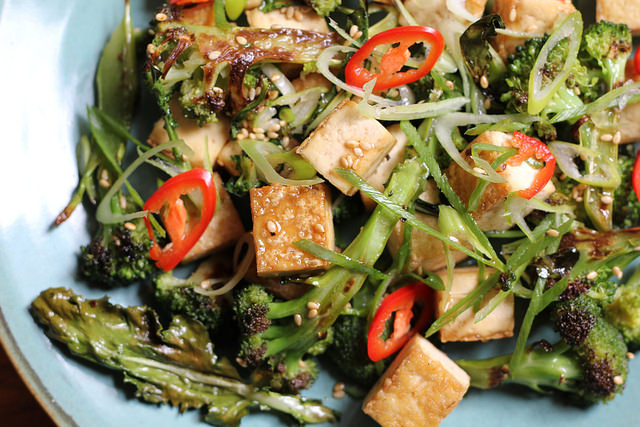
This screenshot has height=427, width=640. In order to click on blue plate in this screenshot , I will do `click(92, 408)`.